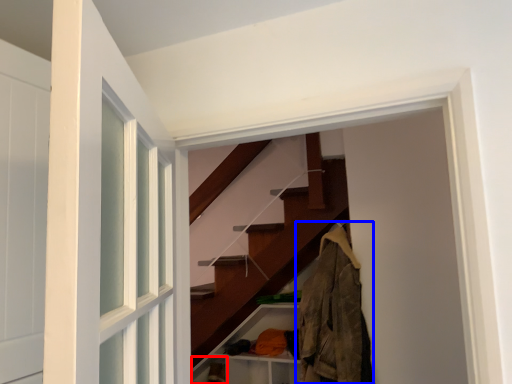
Question: Which object appears closest to the camera in this image, shelf (highlighted by a red box) or clothing (highlighted by a blue box)?

Choices:
 (A) shelf
 (B) clothing

Answer: (B)